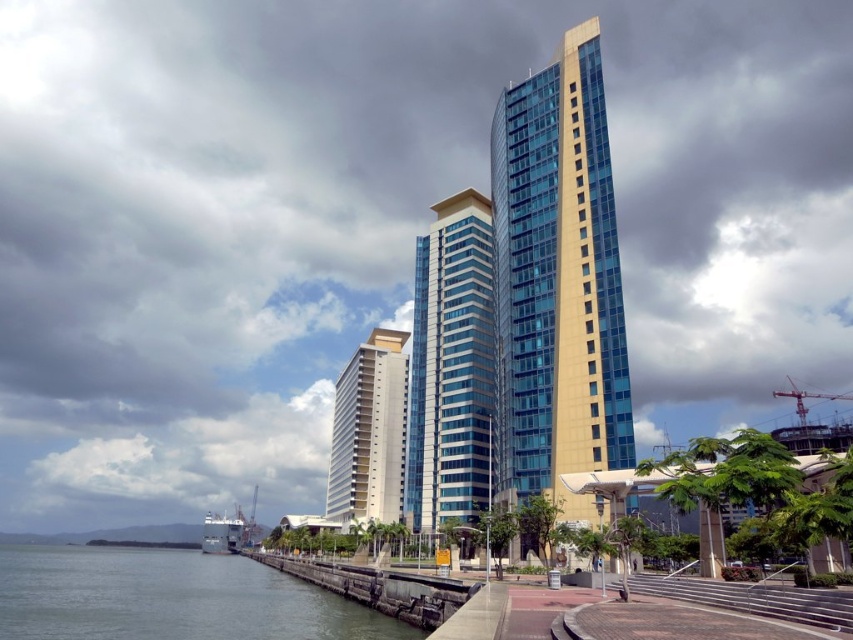
From the picture: You are a photographer planning to capture the waterfront scene. You want to ensure that both the green water at lower left and the sleek glass building at center are clearly visible in your shot. Given their sizes, which object should you focus on first to frame the composition effectively?

The green water at lower left has a larger size compared to the sleek glass building at center, so you should focus on framing the green water at lower left first to accommodate its larger presence in the composition.

You are standing on the walkway and want to take a photo of the green water at lower left without the sleek glass building at center blocking the view. Is this possible?

The green water at lower left is positioned under the sleek glass building at center, so the building would block the view of the water unless you move to a lower position or angle your camera downward.

You are an architect visiting the waterfront and see the gold glass building at center and the sleek glass building at center. Which one is smaller in size?

The gold glass building at center is smaller in size compared to the sleek glass building at center.